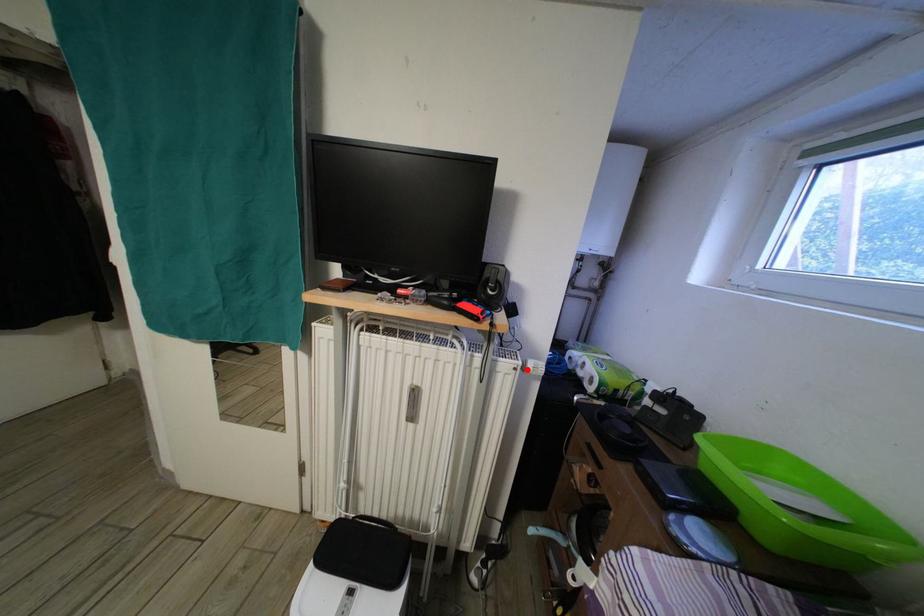
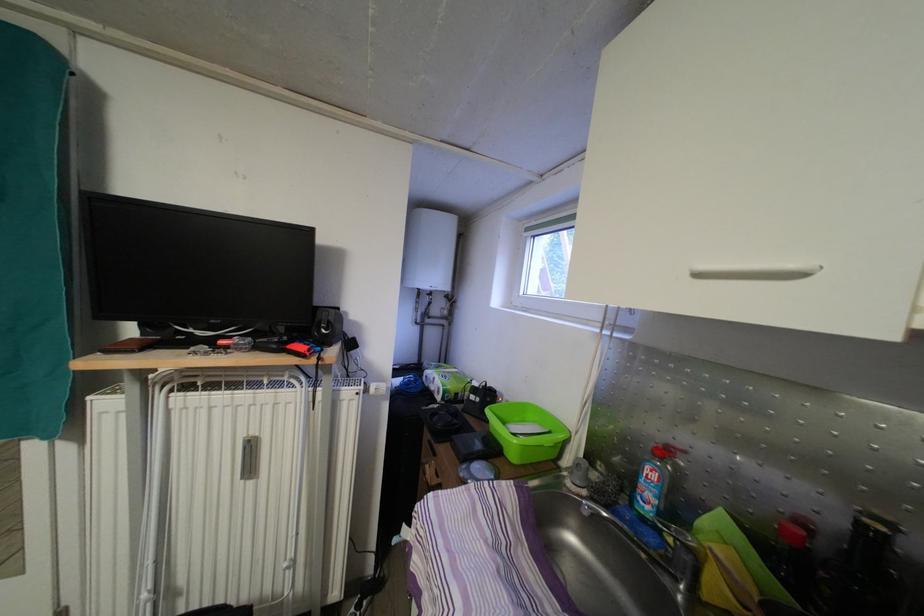
Find the pixel in the second image that matches the highlighted location in the first image.

(369, 394)